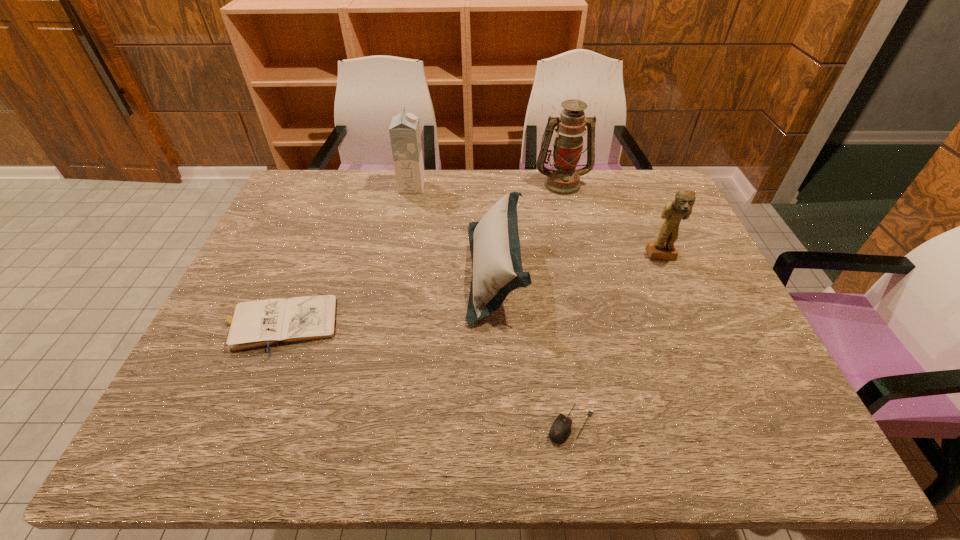
Identify the location of oil lamp. (563, 179).

Locate an element on the screen. This screenshot has width=960, height=540. the second object from left to right is located at coordinates (404, 130).

The image size is (960, 540). Identify the location of the rightmost object. (674, 211).

At what (x,y) coordinates should I click in order to perform the action: click on figurine. Please return your answer as a coordinate pair (x, y). The width and height of the screenshot is (960, 540). Looking at the image, I should click on (674, 211).

Identify the location of the fourth tallest object. The width and height of the screenshot is (960, 540). (497, 270).

The height and width of the screenshot is (540, 960). I want to click on the third object from left to right, so click(497, 270).

Where is `the leftmost object`? the leftmost object is located at coordinates (254, 324).

This screenshot has height=540, width=960. I want to click on mouse, so click(560, 430).

At what (x,y) coordinates should I click in order to perform the action: click on free region located on the left of the oil lamp. Please return your answer as a coordinate pair (x, y). The image size is (960, 540). Looking at the image, I should click on (514, 184).

This screenshot has width=960, height=540. I want to click on vacant area situated 0.170m on the front label of the carton, so click(473, 187).